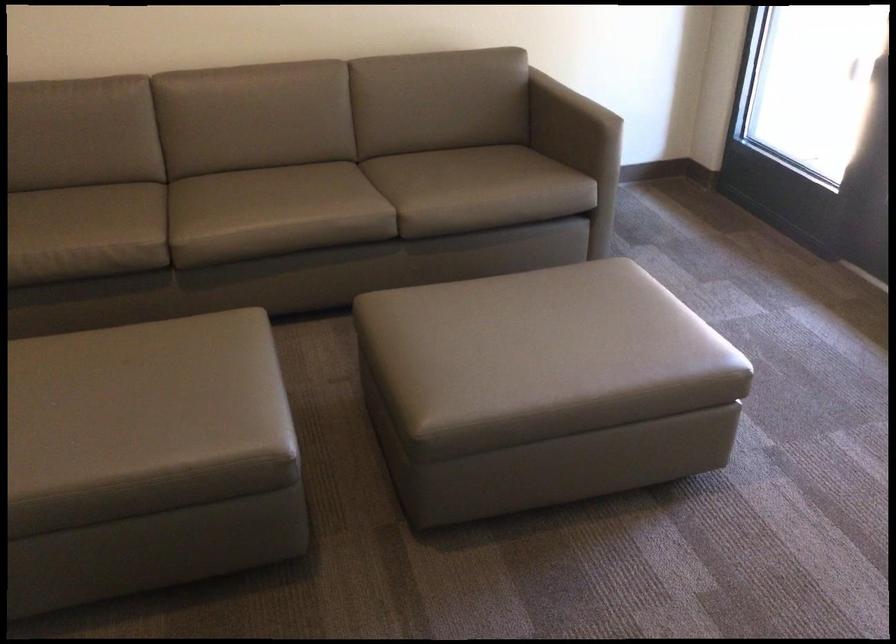
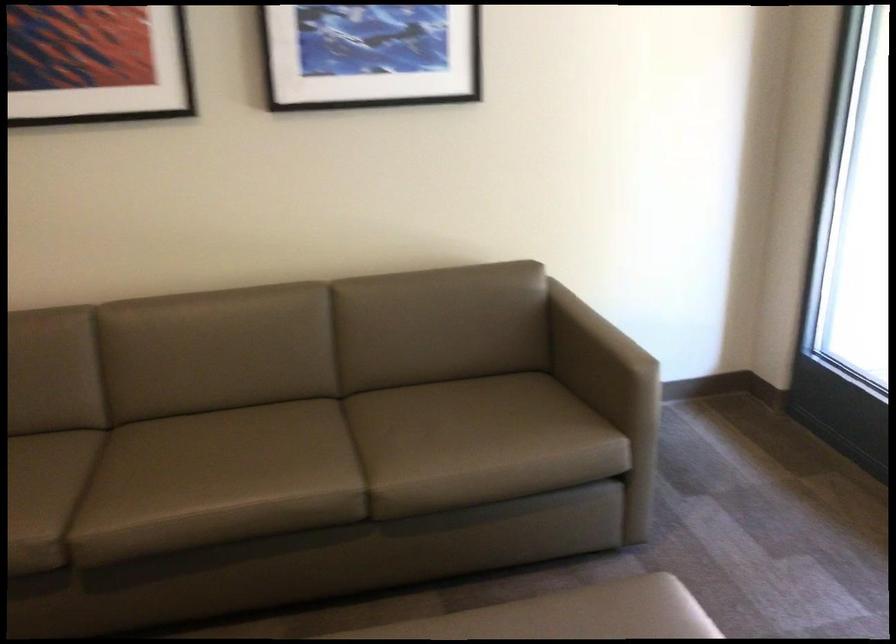
The point at (565,111) is marked in the first image. Where is the corresponding point in the second image?

(597, 355)